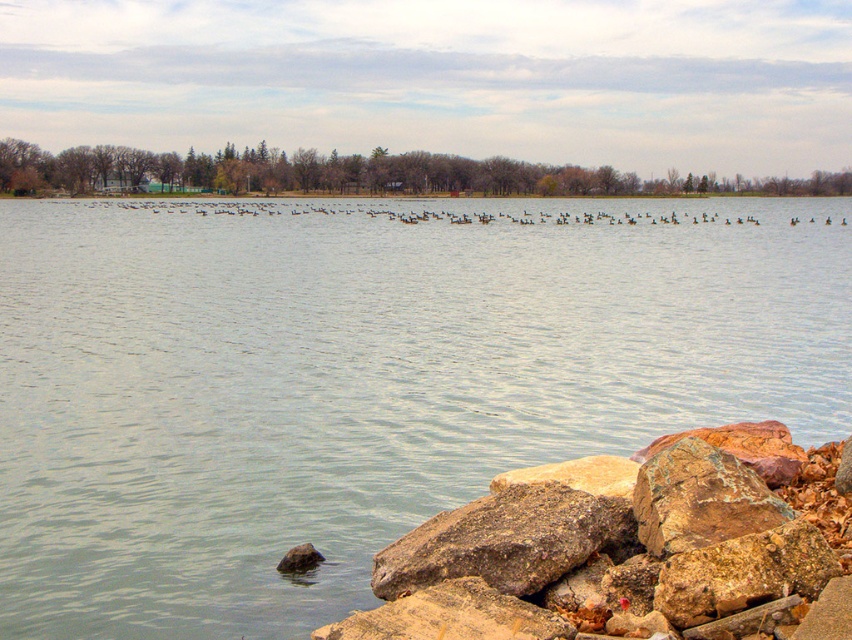
Question: Is clear water at center below rusty stone pile at lower right?

Choices:
 (A) yes
 (B) no

Answer: (B)

Question: From the image, what is the correct spatial relationship of clear water at center in relation to rusty stone pile at lower right?

Choices:
 (A) left
 (B) right

Answer: (A)

Question: Can you confirm if clear water at center is wider than rusty stone pile at lower right?

Choices:
 (A) yes
 (B) no

Answer: (A)